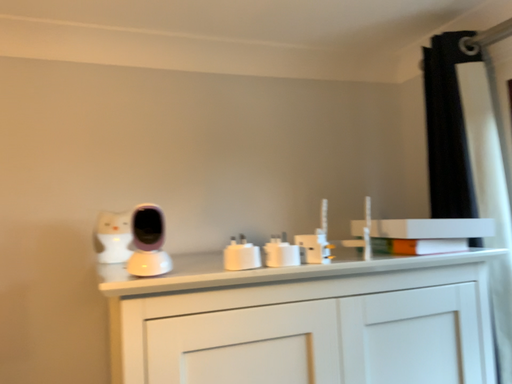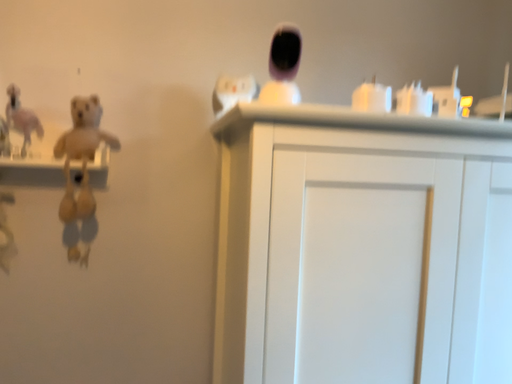
Question: How did the camera likely rotate when shooting the video?

Choices:
 (A) rotated upward
 (B) rotated downward

Answer: (B)